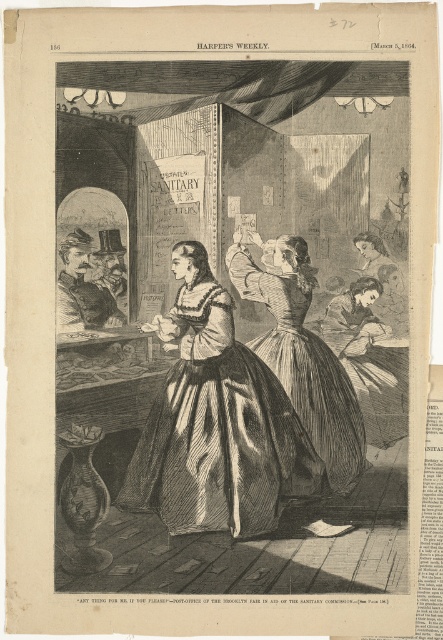
Question: Can you confirm if silvery satin dress at center is positioned to the right of silvery metallic dress at center?

Choices:
 (A) no
 (B) yes

Answer: (A)

Question: Observing the image, what is the correct spatial positioning of silvery satin dress at center in reference to silvery metallic dress at center?

Choices:
 (A) above
 (B) below

Answer: (B)

Question: Among these points, which one is farthest from the camera?

Choices:
 (A) (317, 424)
 (B) (265, 442)

Answer: (A)

Question: Is silvery satin dress at center above silvery metallic dress at center?

Choices:
 (A) yes
 (B) no

Answer: (B)

Question: Which of the following is the farthest from the observer?

Choices:
 (A) silvery satin dress at center
 (B) silvery metallic dress at center

Answer: (B)